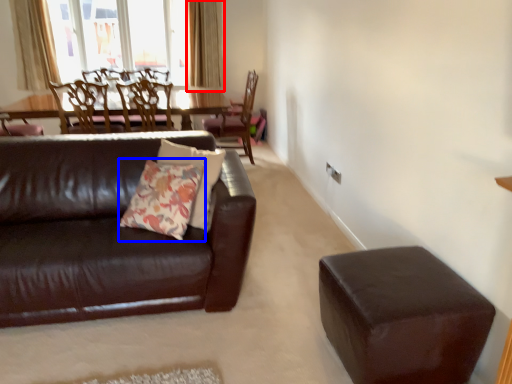
Question: Which object is closer to the camera taking this photo, curtain (highlighted by a red box) or throw pillow (highlighted by a blue box)?

Choices:
 (A) curtain
 (B) throw pillow

Answer: (B)